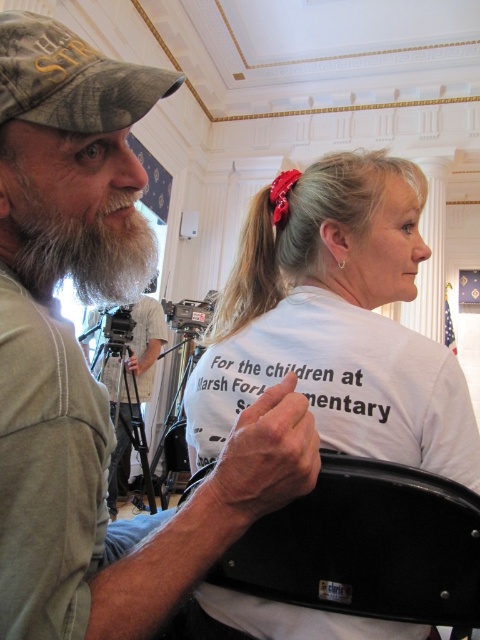
Question: Which of the following is the farthest from the observer?

Choices:
 (A) (466, 557)
 (B) (414, 428)
 (C) (196, 326)
 (D) (338, 321)

Answer: (C)

Question: Can you confirm if camouflage fabric hat at upper left is thinner than camouflage fabric baseball cap at upper left?

Choices:
 (A) yes
 (B) no

Answer: (B)

Question: Is black plastic chair at center behind graywoollybeard at left?

Choices:
 (A) yes
 (B) no

Answer: (A)

Question: Which of the following is the closest to the observer?

Choices:
 (A) camouflage fabric hat at upper left
 (B) black matte tripod at center

Answer: (A)

Question: Which point is farther to the camera?

Choices:
 (A) (96, 160)
 (B) (14, 173)
 (C) (402, 365)
 (D) (62, 112)

Answer: (C)

Question: Does white cotton t-shirt at center appear on the left side of graywoollybeard at left?

Choices:
 (A) yes
 (B) no

Answer: (B)